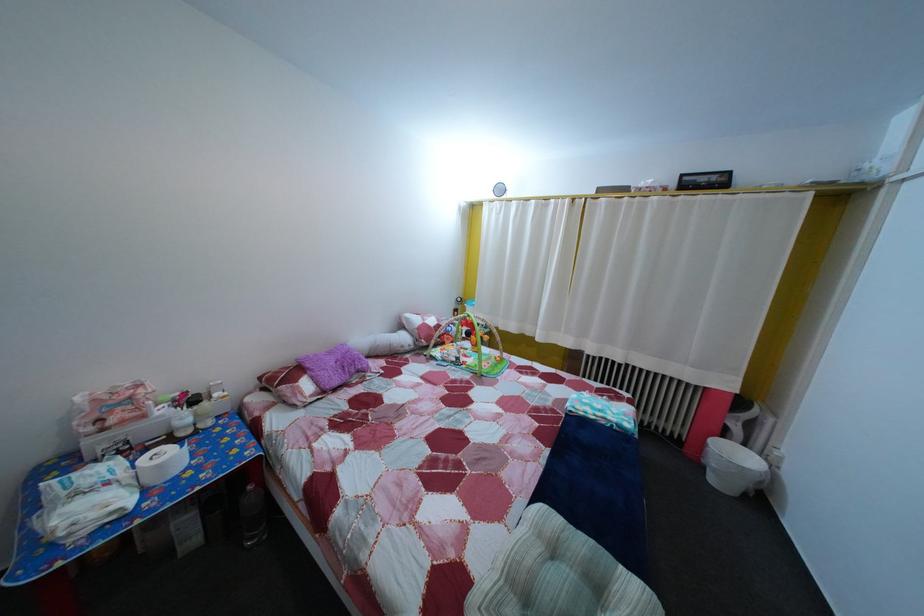
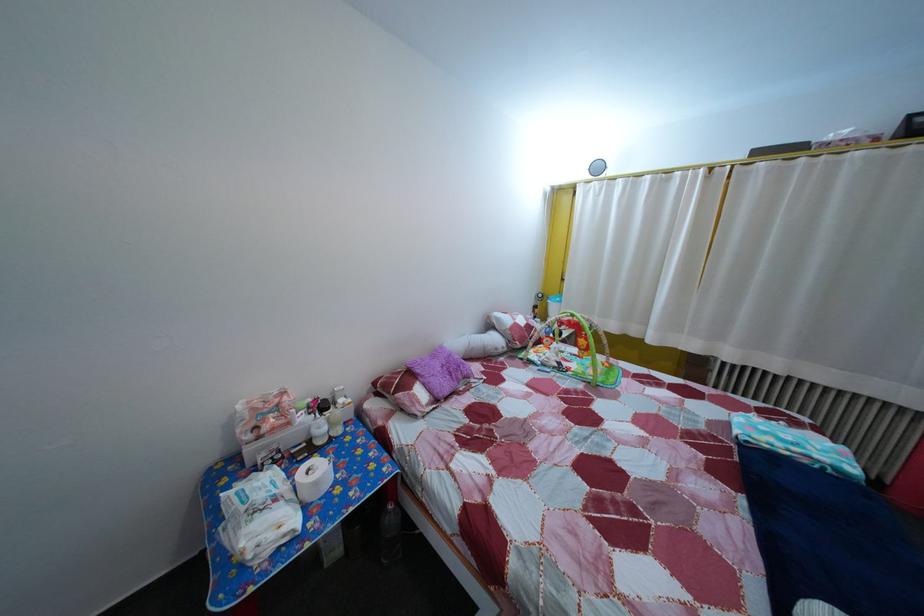
The point at [116,492] is marked in the first image. Where is the corresponding point in the second image?

(285, 508)